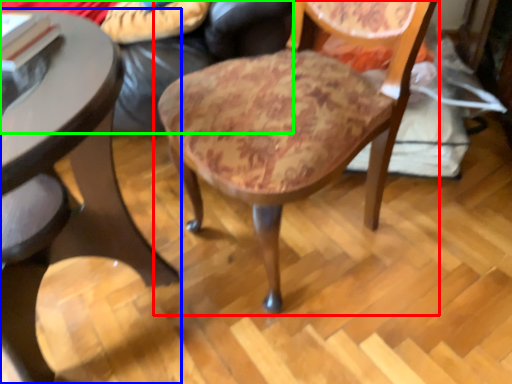
Question: Based on their relative distances, which object is nearer to chair (highlighted by a red box)? Choose from table (highlighted by a blue box) and couch (highlighted by a green box).

Choices:
 (A) table
 (B) couch

Answer: (B)